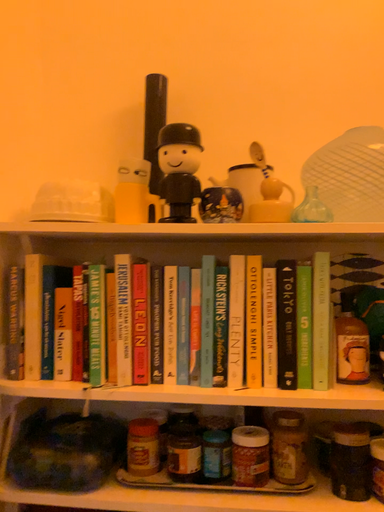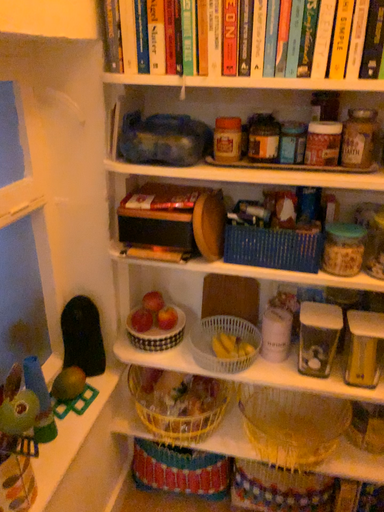
Question: How did the camera likely rotate when shooting the video?

Choices:
 (A) rotated right
 (B) rotated left

Answer: (B)